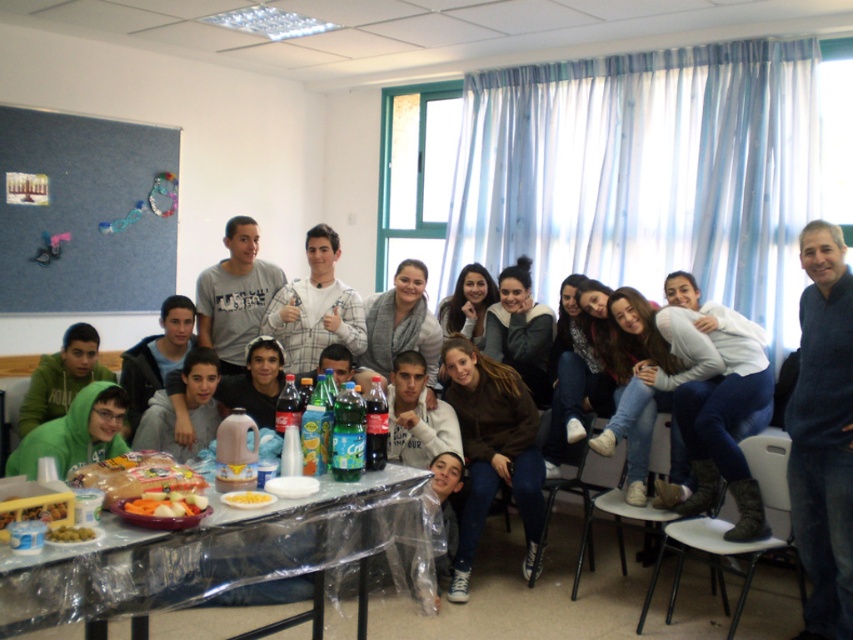
You are a photographer taking a picture of the group in the classroom. You notice the smooth plastic container of mixed vegetables at center and the green matte olives at lower left. Which object is blocking the view of the other?

The smooth plastic container of mixed vegetables at center is positioned over green matte olives at lower left, so it is blocking the view of the green matte olives at lower left.

You are standing at the center of the room and want to move to the clear plastic table at lower left. Which direction should you move to reach it?

Since the clear plastic table at lower left is located at point (229, 554), you should move towards the lower left direction to reach it.

You are a photographer setting up for a group photo in the classroom. You notice the clear plastic table at lower left and the yellow matte corn at center. Which object is positioned to the right of the other?

The clear plastic table at lower left is to the right of the yellow matte corn at center.